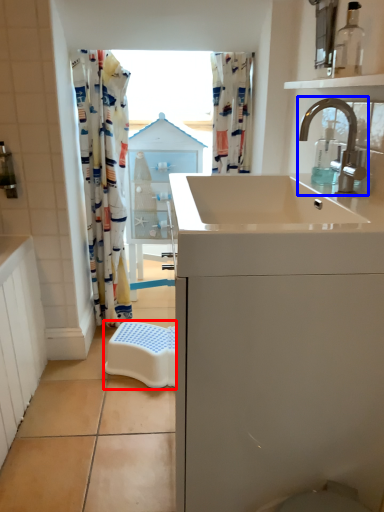
Question: Which of the following is the farthest to the observer, stool (highlighted by a red box) or tap (highlighted by a blue box)?

Choices:
 (A) stool
 (B) tap

Answer: (A)